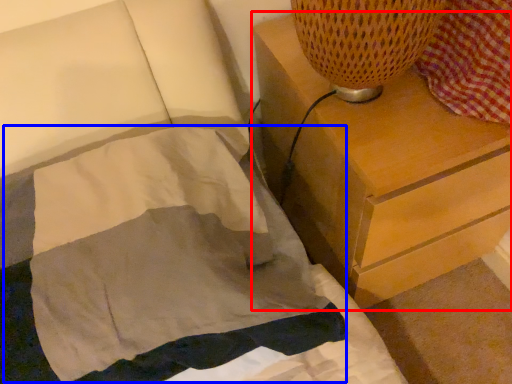
Question: Among these objects, which one is farthest to the camera, chest of drawers (highlighted by a red box) or blanket (highlighted by a blue box)?

Choices:
 (A) chest of drawers
 (B) blanket

Answer: (A)